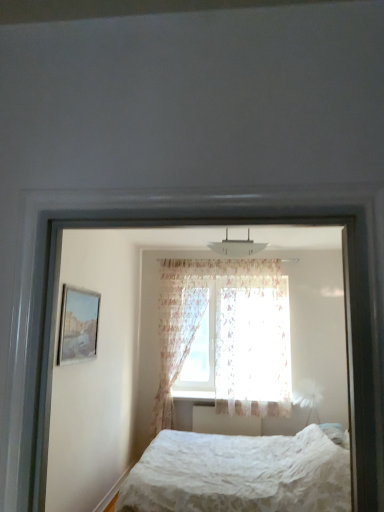
Question: Is matte glass picture frame at left inside or outside of white textured bed at center, marked as the 2th bed in a back-to-front arrangement?

Choices:
 (A) inside
 (B) outside

Answer: (B)

Question: From their relative heights in the image, would you say matte glass picture frame at left is taller or shorter than white textured bed at center, which is the 1th bed from top to bottom?

Choices:
 (A) short
 (B) tall

Answer: (A)

Question: Based on their relative distances, which object is farther from the white textured bed at center, which is the 1th bed from top to bottom?

Choices:
 (A) matte glass picture frame at left
 (B) floral fabric curtain at center, the first curtain when ordered from left to right
 (C) translucent floral fabric at center, positioned as the first curtain in right-to-left order
 (D) white plastic radiator at center
 (E) white lace bed at lower center, which appears as the 1th bed when viewed from the back

Answer: (A)

Question: Estimate the real-world distances between objects in this image. Which object is farther from the white lace bed at lower center, the second bed from the front?

Choices:
 (A) white plastic radiator at center
 (B) white textured bed at center, which is the 1th bed from top to bottom
 (C) translucent floral fabric at center, positioned as the first curtain in right-to-left order
 (D) matte glass picture frame at left
 (E) floral fabric curtain at center, the first curtain when ordered from left to right

Answer: (E)